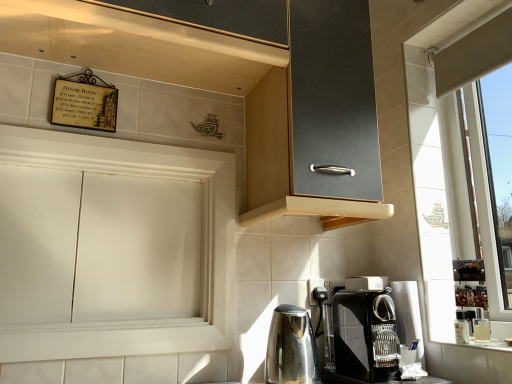
Question: Does polished stainless steel kettle at lower center contain white matte cabinet at left, the 2th cabinetry in the top-to-bottom sequence?

Choices:
 (A) no
 (B) yes

Answer: (A)

Question: From the image's perspective, does polished stainless steel kettle at lower center appear higher than white matte cabinet at left, the 2th cabinetry in the top-to-bottom sequence?

Choices:
 (A) no
 (B) yes

Answer: (A)

Question: Is polished stainless steel kettle at lower center not near white matte cabinet at left, the first cabinetry in the bottom-to-top sequence?

Choices:
 (A) yes
 (B) no

Answer: (B)

Question: Is polished stainless steel kettle at lower center touching white matte cabinet at left, the first cabinetry in the bottom-to-top sequence?

Choices:
 (A) no
 (B) yes

Answer: (A)

Question: From a real-world perspective, is polished stainless steel kettle at lower center on top of white matte cabinet at left, the first cabinetry in the bottom-to-top sequence?

Choices:
 (A) no
 (B) yes

Answer: (A)

Question: Relative to matte black cabinet at upper center, the 2th cabinetry from the bottom, is black glossy coffee maker at lower right in front or behind?

Choices:
 (A) front
 (B) behind

Answer: (B)

Question: In terms of size, does black glossy coffee maker at lower right appear bigger or smaller than matte black cabinet at upper center, the 2th cabinetry from the bottom?

Choices:
 (A) small
 (B) big

Answer: (A)

Question: Is point (394, 367) positioned closer to the camera than point (367, 6)?

Choices:
 (A) closer
 (B) farther

Answer: (A)

Question: From the image's perspective, is black glossy coffee maker at lower right above or below matte black cabinet at upper center, the 2th cabinetry from the bottom?

Choices:
 (A) above
 (B) below

Answer: (B)

Question: In terms of height, does polished stainless steel kettle at lower center look taller or shorter compared to matte black cabinet at upper center, marked as the first cabinetry in a top-to-bottom arrangement?

Choices:
 (A) tall
 (B) short

Answer: (B)

Question: Is polished stainless steel kettle at lower center inside the boundaries of matte black cabinet at upper center, marked as the first cabinetry in a top-to-bottom arrangement, or outside?

Choices:
 (A) inside
 (B) outside

Answer: (B)

Question: Is polished stainless steel kettle at lower center to the left or to the right of matte black cabinet at upper center, marked as the first cabinetry in a top-to-bottom arrangement, in the image?

Choices:
 (A) left
 (B) right

Answer: (B)

Question: In terms of width, does polished stainless steel kettle at lower center look wider or thinner when compared to matte black cabinet at upper center, marked as the first cabinetry in a top-to-bottom arrangement?

Choices:
 (A) wide
 (B) thin

Answer: (B)

Question: From a real-world perspective, is white matte cabinet at left, the first cabinetry in the bottom-to-top sequence, above or below matte black cabinet at upper center, marked as the first cabinetry in a top-to-bottom arrangement?

Choices:
 (A) below
 (B) above

Answer: (A)

Question: From the image's perspective, relative to matte black cabinet at upper center, marked as the first cabinetry in a top-to-bottom arrangement, is white matte cabinet at left, the first cabinetry in the bottom-to-top sequence, above or below?

Choices:
 (A) above
 (B) below

Answer: (B)